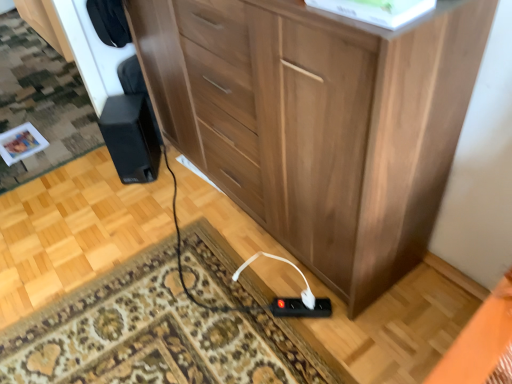
Where is `free spot behind black plastic power strip at lower center, positioned as the first plug in left-to-right order`? This screenshot has height=384, width=512. free spot behind black plastic power strip at lower center, positioned as the first plug in left-to-right order is located at coordinates (281, 275).